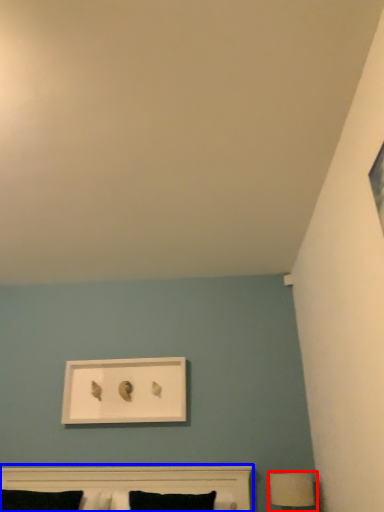
Question: Among these objects, which one is farthest to the camera, table lamp (highlighted by a red box) or bed (highlighted by a blue box)?

Choices:
 (A) table lamp
 (B) bed

Answer: (A)